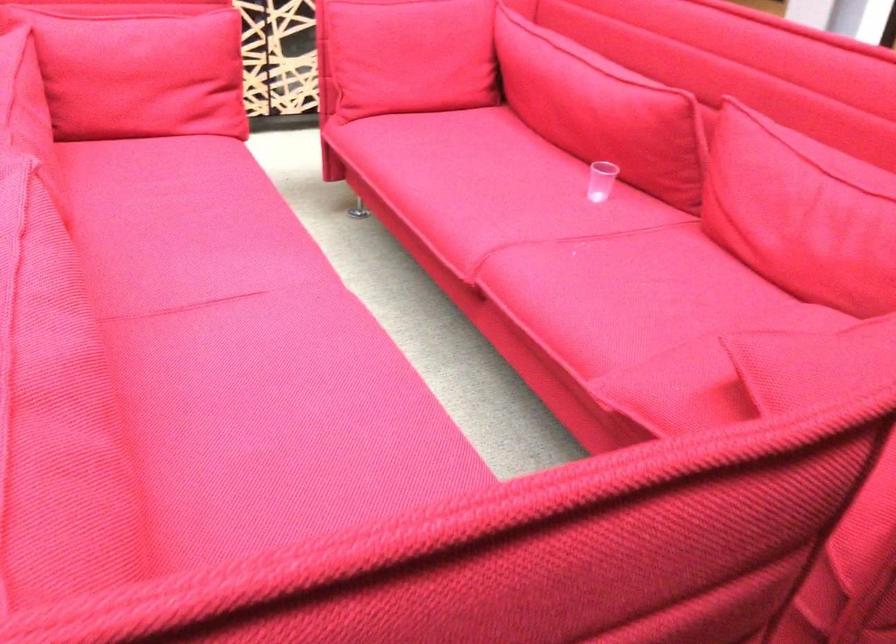
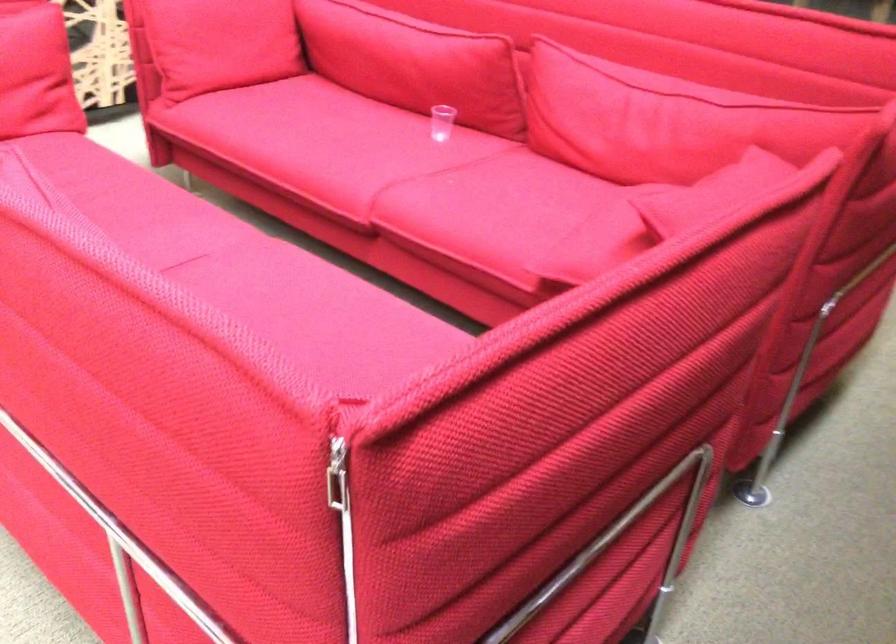
Question: The camera is either moving clockwise (left) or counter-clockwise (right) around the object. The first image is from the beginning of the video and the second image is from the end. Is the camera moving left or right when shooting the video?

Choices:
 (A) Left
 (B) Right

Answer: (A)